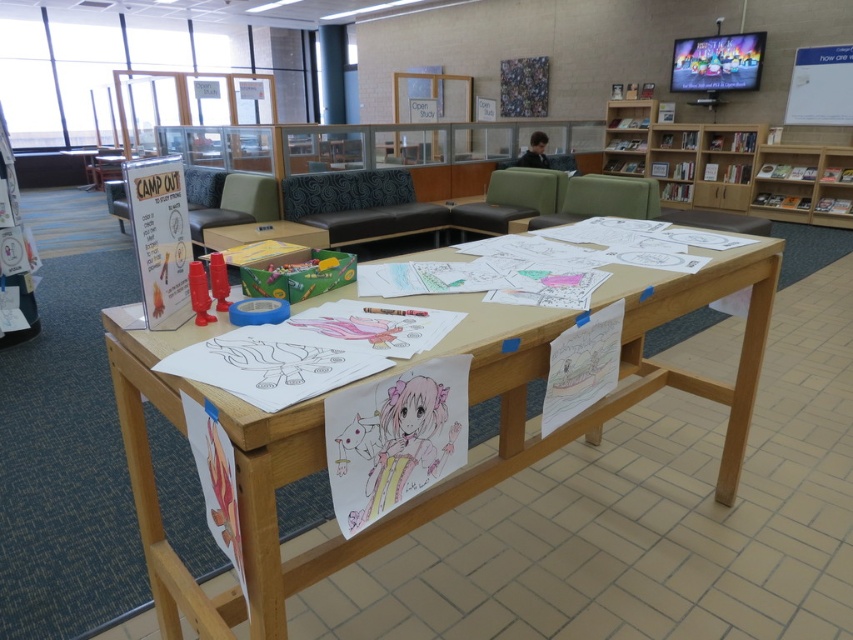
Question: Is wooden table at center smaller than wooden bookshelf at upper right?

Choices:
 (A) yes
 (B) no

Answer: (A)

Question: Can you confirm if wooden table at center is positioned above wooden bookshelf at upper right?

Choices:
 (A) yes
 (B) no

Answer: (B)

Question: Among these points, which one is nearest to the camera?

Choices:
 (A) (763, 180)
 (B) (163, 636)

Answer: (B)

Question: Does wooden table at center have a larger size compared to wooden bookshelf at upper right?

Choices:
 (A) no
 (B) yes

Answer: (A)

Question: Which of the following is the closest to the observer?

Choices:
 (A) wooden bookshelf at upper right
 (B) wooden table at center

Answer: (B)